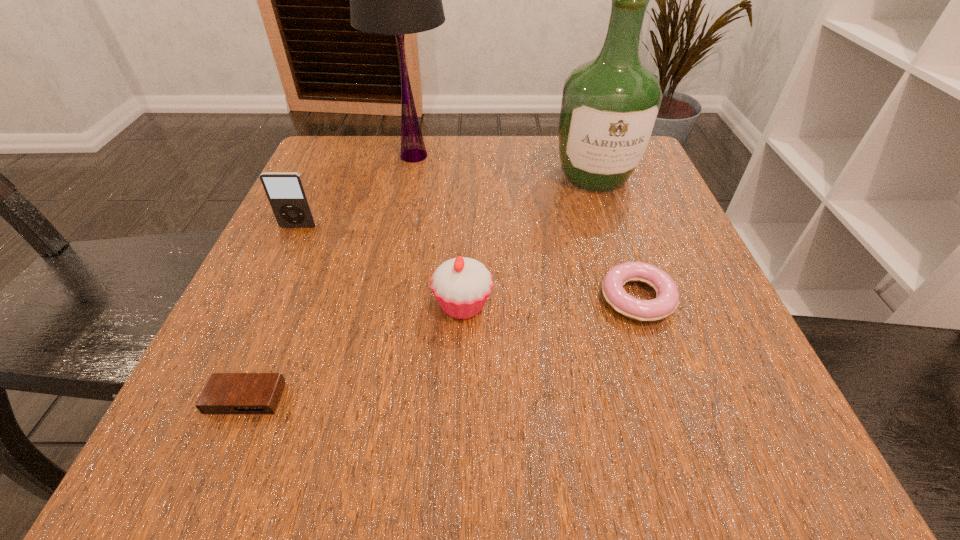
Find the location of a particular element. This screenshot has width=960, height=540. free point between the liquor and the alarm clock is located at coordinates click(x=420, y=287).

Find the location of a particular element. The width and height of the screenshot is (960, 540). vacant space that's between the third tallest object and the lampshade is located at coordinates (356, 191).

Locate an element on the screen. object that stands as the third closest to the second shortest object is located at coordinates (396, 0).

Select which object is the fourth closest to the iPod. Please provide its 2D coordinates. Your answer should be formatted as a tuple, i.e. [(x, y)], where the tuple contains the x and y coordinates of a point satisfying the conditions above.

[(610, 105)]

The height and width of the screenshot is (540, 960). I want to click on free point that satisfies the following two spatial constraints: 1. on the front-facing side of the lampshade; 2. on the left side of the cupcake, so click(383, 305).

At what (x,y) coordinates should I click in order to perform the action: click on vacant space that satisfies the following two spatial constraints: 1. on the front-facing side of the lampshade; 2. on the left side of the fifth tallest object. Please return your answer as a coordinate pair (x, y). Looking at the image, I should click on (385, 299).

At what (x,y) coordinates should I click in order to perform the action: click on free region that satisfies the following two spatial constraints: 1. on the front-facing side of the lampshade; 2. on the left side of the fourth tallest object. Please return your answer as a coordinate pair (x, y). This screenshot has width=960, height=540. Looking at the image, I should click on (383, 305).

The height and width of the screenshot is (540, 960). In order to click on free spot that satisfies the following two spatial constraints: 1. on the front-facing side of the lampshade; 2. on the front face of the nearest object in this screenshot , I will do (x=364, y=398).

At what (x,y) coordinates should I click in order to perform the action: click on free spot that satisfies the following two spatial constraints: 1. on the front-facing side of the fifth tallest object; 2. on the right side of the lampshade. Please return your answer as a coordinate pair (x, y). The height and width of the screenshot is (540, 960). Looking at the image, I should click on (385, 299).

Find the location of a particular element. The image size is (960, 540). free space that satisfies the following two spatial constraints: 1. on the front-facing side of the lampshade; 2. on the right side of the third shortest object is located at coordinates (383, 305).